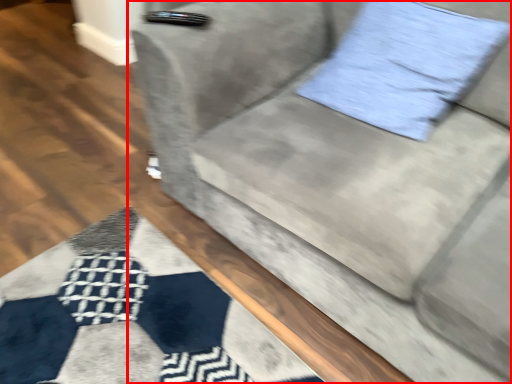
Question: From the image's perspective, what is the correct spatial positioning of studio couch (annotated by the red box) in reference to pillow?

Choices:
 (A) below
 (B) above

Answer: (A)